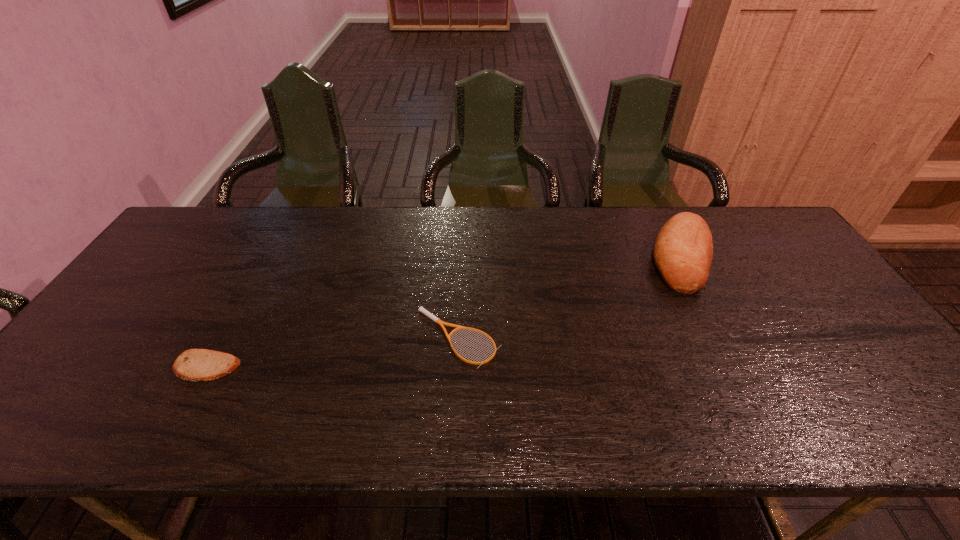
At what (x,y) coordinates should I click in order to perform the action: click on free space at the far edge. Please return your answer as a coordinate pair (x, y). Looking at the image, I should click on (384, 230).

The image size is (960, 540). What are the coordinates of `vacant position at the near edge of the desktop` in the screenshot? It's located at (643, 417).

Locate an element on the screen. This screenshot has height=540, width=960. free space at the left edge is located at coordinates (187, 291).

The width and height of the screenshot is (960, 540). In the image, there is a desktop. Find the location of `vacant space at the far left corner`. vacant space at the far left corner is located at coordinates (205, 249).

Find the location of `vacant space at the near left corner of the desktop`. vacant space at the near left corner of the desktop is located at coordinates (53, 436).

Where is `blank space at the far right corner`? blank space at the far right corner is located at coordinates (747, 226).

Image resolution: width=960 pixels, height=540 pixels. Identify the location of unoccupied position between the second shortest object and the rightmost object. (444, 312).

The height and width of the screenshot is (540, 960). In order to click on vacant space that is in between the rightmost object and the leftmost object in this screenshot , I will do `click(444, 312)`.

You are a GUI agent. You are given a task and a screenshot of the screen. Output one action in this format:
    pyautogui.click(x=<x>, y=<y>)
    Task: Click on the vacant area between the second tallest object and the tennis racket
    This screenshot has height=540, width=960.
    Given the screenshot: What is the action you would take?
    point(332,353)

Locate an element on the screen. The image size is (960, 540). unoccupied position between the rightmost object and the pita bread is located at coordinates click(444, 312).